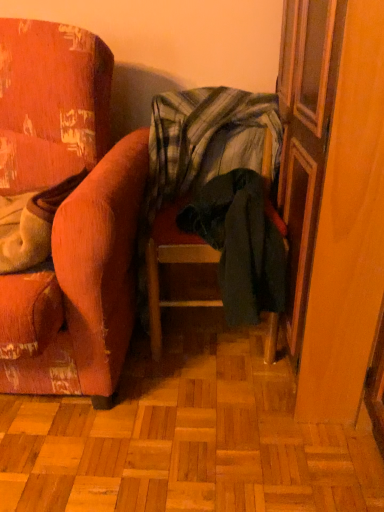
Question: Which direction should I rotate to look at dark green fabric chair at center, the second chair in the left-to-right sequence, — up or down?

Choices:
 (A) down
 (B) up

Answer: (B)

Question: Is velvet orange armchair at left, acting as the 1th chair starting from the left, not near plaid fabric blanket at center?

Choices:
 (A) yes
 (B) no

Answer: (B)

Question: Considering the relative sizes of velvet orange armchair at left, which is counted as the 2th chair, starting from the right, and plaid fabric blanket at center in the image provided, is velvet orange armchair at left, which is counted as the 2th chair, starting from the right, bigger than plaid fabric blanket at center?

Choices:
 (A) no
 (B) yes

Answer: (B)

Question: Can you confirm if velvet orange armchair at left, which is counted as the 2th chair, starting from the right, is positioned to the left of plaid fabric blanket at center?

Choices:
 (A) yes
 (B) no

Answer: (A)

Question: Considering the relative sizes of velvet orange armchair at left, which is counted as the 2th chair, starting from the right, and plaid fabric blanket at center in the image provided, is velvet orange armchair at left, which is counted as the 2th chair, starting from the right, shorter than plaid fabric blanket at center?

Choices:
 (A) no
 (B) yes

Answer: (A)

Question: Is velvet orange armchair at left, which is counted as the 2th chair, starting from the right, further to the viewer compared to plaid fabric blanket at center?

Choices:
 (A) yes
 (B) no

Answer: (B)

Question: Is velvet orange armchair at left, which is counted as the 2th chair, starting from the right, completely or partially outside of plaid fabric blanket at center?

Choices:
 (A) yes
 (B) no

Answer: (A)

Question: Considering the relative positions of wooden screen door at right and dark green fabric chair at center, the 1th chair in the right-to-left sequence, in the image provided, is wooden screen door at right to the right of dark green fabric chair at center, the 1th chair in the right-to-left sequence, from the viewer's perspective?

Choices:
 (A) no
 (B) yes

Answer: (B)

Question: Does wooden screen door at right appear on the left side of dark green fabric chair at center, the second chair in the left-to-right sequence?

Choices:
 (A) no
 (B) yes

Answer: (A)

Question: Is wooden screen door at right closer to the viewer compared to dark green fabric chair at center, the 1th chair in the right-to-left sequence?

Choices:
 (A) yes
 (B) no

Answer: (A)

Question: Can you confirm if wooden screen door at right is wider than dark green fabric chair at center, the second chair in the left-to-right sequence?

Choices:
 (A) yes
 (B) no

Answer: (A)

Question: Does wooden screen door at right have a lesser height compared to dark green fabric chair at center, the second chair in the left-to-right sequence?

Choices:
 (A) no
 (B) yes

Answer: (A)

Question: From a real-world perspective, is wooden screen door at right over dark green fabric chair at center, the 1th chair in the right-to-left sequence?

Choices:
 (A) no
 (B) yes

Answer: (B)

Question: Does wooden screen door at right have a larger size compared to plaid fabric blanket at center?

Choices:
 (A) no
 (B) yes

Answer: (B)